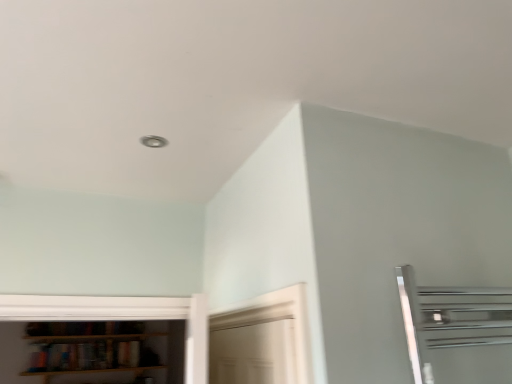
The height and width of the screenshot is (384, 512). What do you see at coordinates (91, 355) in the screenshot?
I see `wooden bookshelf at lower left` at bounding box center [91, 355].

Locate an element on the screen. This screenshot has height=384, width=512. wooden bookshelf at lower left is located at coordinates (91, 355).

Image resolution: width=512 pixels, height=384 pixels. What are the coordinates of `wooden bookshelf at lower left` in the screenshot? It's located at (91, 355).